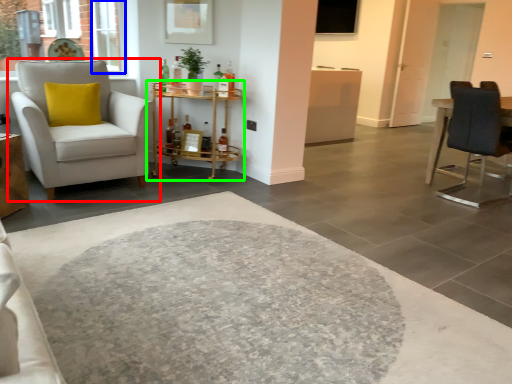
Question: Considering the real-world distances, which object is closest to chair (highlighted by a red box)? window (highlighted by a blue box) or table (highlighted by a green box).

Choices:
 (A) window
 (B) table

Answer: (B)